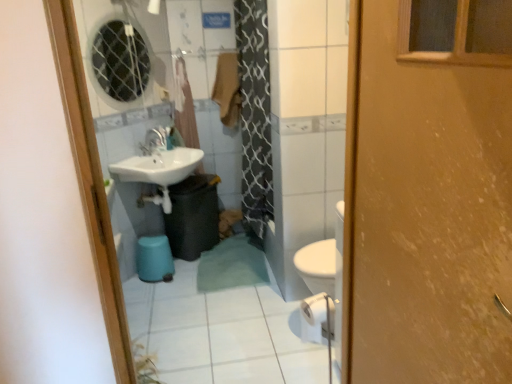
Question: In terms of height, does matte white faucet at center look taller or shorter compared to translucent plastic curtain at upper center?

Choices:
 (A) short
 (B) tall

Answer: (A)

Question: From the image's perspective, is matte white faucet at center positioned above or below translucent plastic curtain at upper center?

Choices:
 (A) above
 (B) below

Answer: (B)

Question: Estimate the real-world distances between objects in this image. Which object is closer to the transparent glass mirror at upper left?

Choices:
 (A) matte blue stool at lower left
 (B) black plastic trash can at lower center
 (C) matte white faucet at center
 (D) brown fabric towel at upper center
 (E) translucent plastic curtain at upper center

Answer: (E)

Question: Which of these objects is positioned closest to the wooden door at right?

Choices:
 (A) translucent plastic curtain at upper center
 (B) matte white faucet at center
 (C) matte blue stool at lower left
 (D) brown fabric towel at upper center
 (E) black plastic trash can at lower center

Answer: (C)